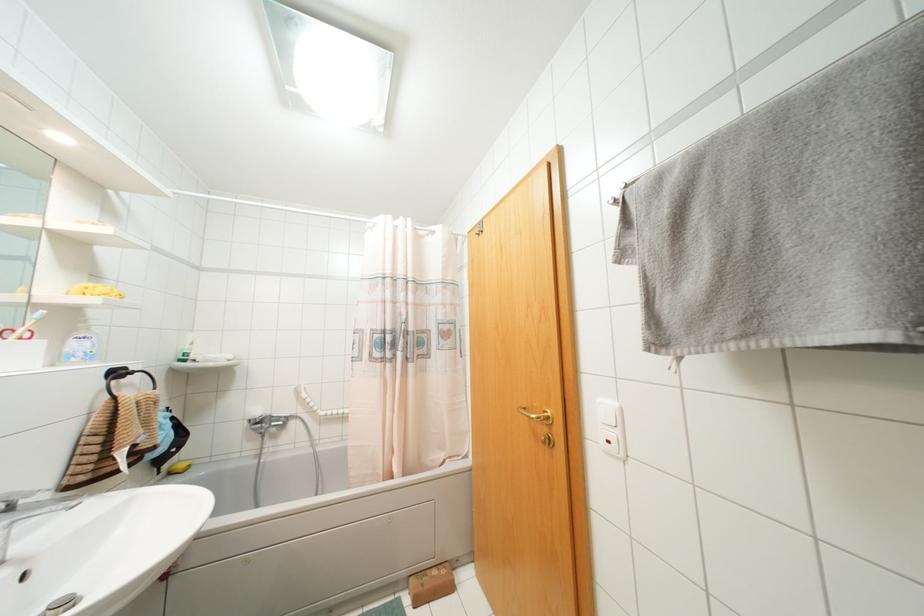
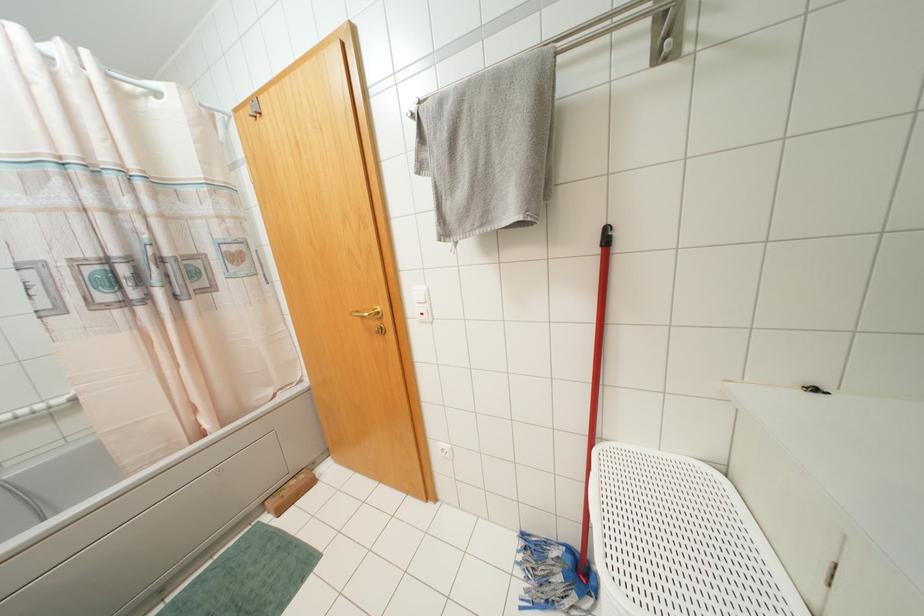
The point at (476, 230) is marked in the first image. Where is the corresponding point in the second image?

(249, 110)